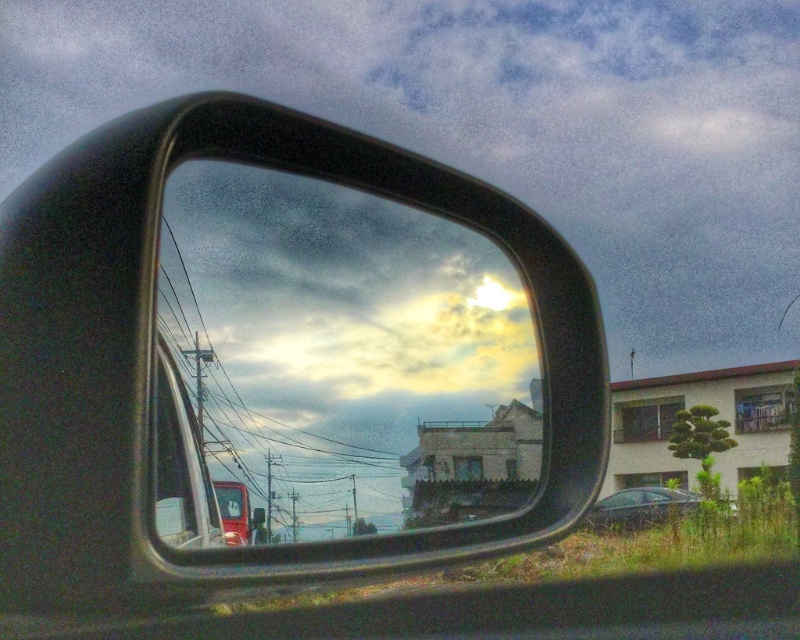
Is clear glass window at center below shiny black sedan at lower right?

Actually, clear glass window at center is above shiny black sedan at lower right.

Based on the photo, is clear glass window at center wider than shiny black sedan at lower right?

In fact, clear glass window at center might be narrower than shiny black sedan at lower right.

Does point (186, 506) come closer to viewer compared to point (614, 513)?

Yes, it is in front of point (614, 513).

Find the location of a particular element. The width and height of the screenshot is (800, 640). clear glass window at center is located at coordinates (180, 465).

From the picture: Can you confirm if transparent glass mirror at center is wider than shiny black sedan at lower right?

No, transparent glass mirror at center is not wider than shiny black sedan at lower right.

Identify the location of transparent glass mirror at center. The height and width of the screenshot is (640, 800). (345, 356).

Where is `transparent glass mirror at center`? transparent glass mirror at center is located at coordinates (345, 356).

This screenshot has height=640, width=800. I want to click on transparent glass mirror at center, so click(x=345, y=356).

Is transparent glass mirror at center to the right of clear glass window at center from the viewer's perspective?

Yes, transparent glass mirror at center is to the right of clear glass window at center.

The width and height of the screenshot is (800, 640). I want to click on transparent glass mirror at center, so [x=345, y=356].

Is point (410, 481) farther from viewer compared to point (172, 518)?

Yes, point (410, 481) is behind point (172, 518).

This screenshot has width=800, height=640. What are the coordinates of `transparent glass mirror at center` in the screenshot? It's located at pyautogui.click(x=345, y=356).